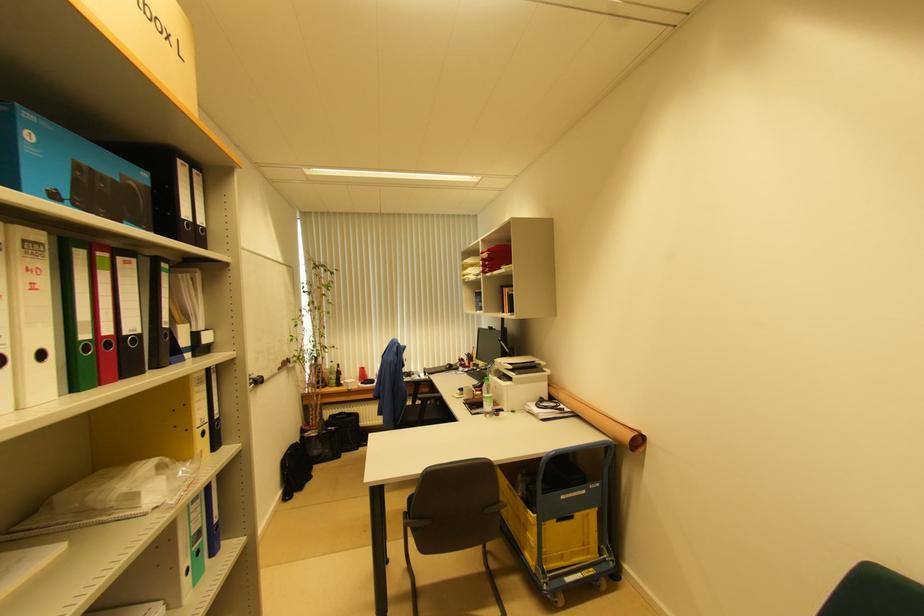
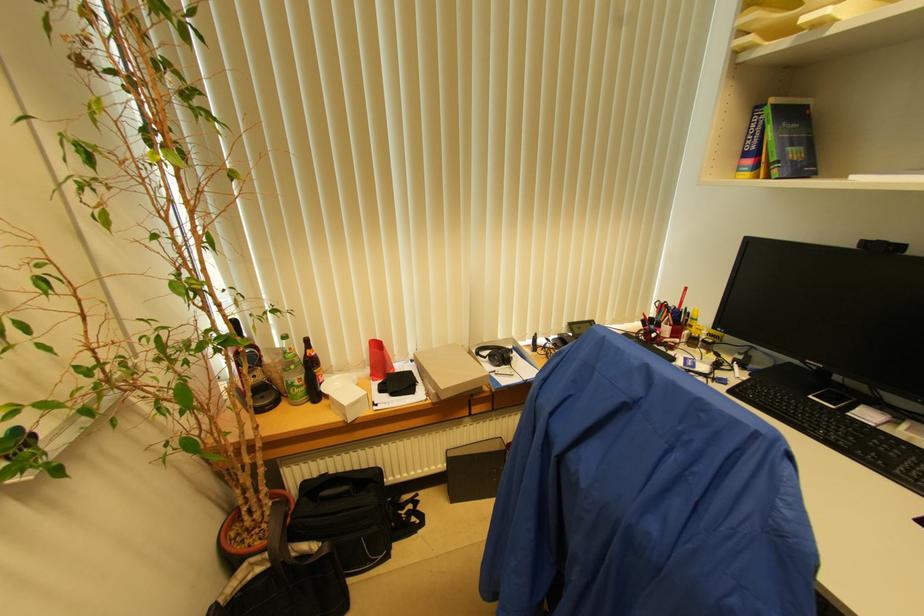
Where in the second image is the point corresponding to pixel 492 331 from the first image?

(882, 251)